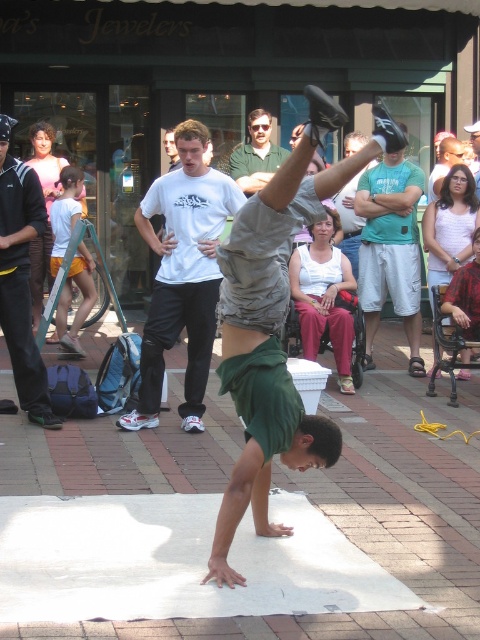
Question: Is matte black hair at upper left positioned at the back of green shirt at center?

Choices:
 (A) no
 (B) yes

Answer: (A)

Question: Among these points, which one is farthest from the camera?

Choices:
 (A) (469, 280)
 (B) (14, 164)
 (C) (437, 241)
 (D) (436, 189)

Answer: (D)

Question: Which of the following is the closest to the observer?

Choices:
 (A) (271, 173)
 (B) (455, 138)
 (C) (479, 304)
 (D) (301, 257)

Answer: (C)

Question: Can you confirm if white cotton tank top at center is thinner than matte white shirt at center?

Choices:
 (A) no
 (B) yes

Answer: (B)

Question: Which object is positioned closest to the white cotton shirt at center?

Choices:
 (A) white cotton tank top at center
 (B) matte black shirt at upper left

Answer: (A)

Question: Is white cotton t-shirt at center to the left of matte black shirt at upper left from the viewer's perspective?

Choices:
 (A) yes
 (B) no

Answer: (B)